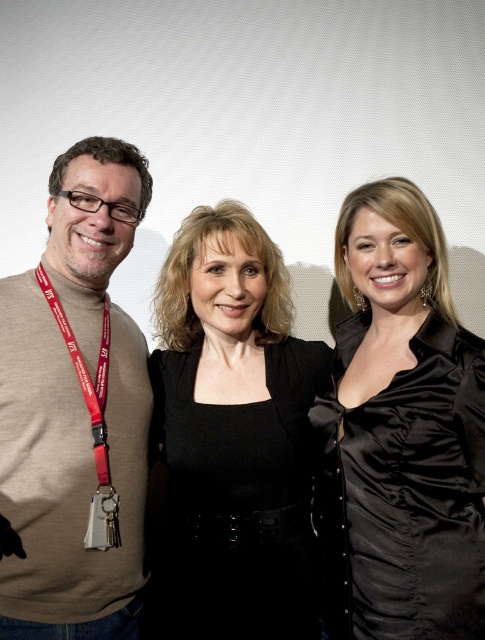
Does black satin blouse at center have a greater width compared to beige turtleneck sweater at left?

Correct, the width of black satin blouse at center exceeds that of beige turtleneck sweater at left.

I want to click on black satin blouse at center, so click(233, 435).

This screenshot has height=640, width=485. What do you see at coordinates (251, 122) in the screenshot? I see `white matte backdrop at center` at bounding box center [251, 122].

Does white matte backdrop at center have a greater height compared to red fabric lanyard at left?

Yes, white matte backdrop at center is taller than red fabric lanyard at left.

Where is `white matte backdrop at center`? white matte backdrop at center is located at coordinates point(251,122).

Is point (161, 189) farther from camera compared to point (390, 241)?

Yes, it is behind point (390, 241).

Which is below, white matte backdrop at center or satin black blouse at center?

Positioned lower is satin black blouse at center.

Is point (141, 3) positioned behind point (483, 388)?

Yes, point (141, 3) is behind point (483, 388).

Locate an element on the screen. The height and width of the screenshot is (640, 485). white matte backdrop at center is located at coordinates (x=251, y=122).